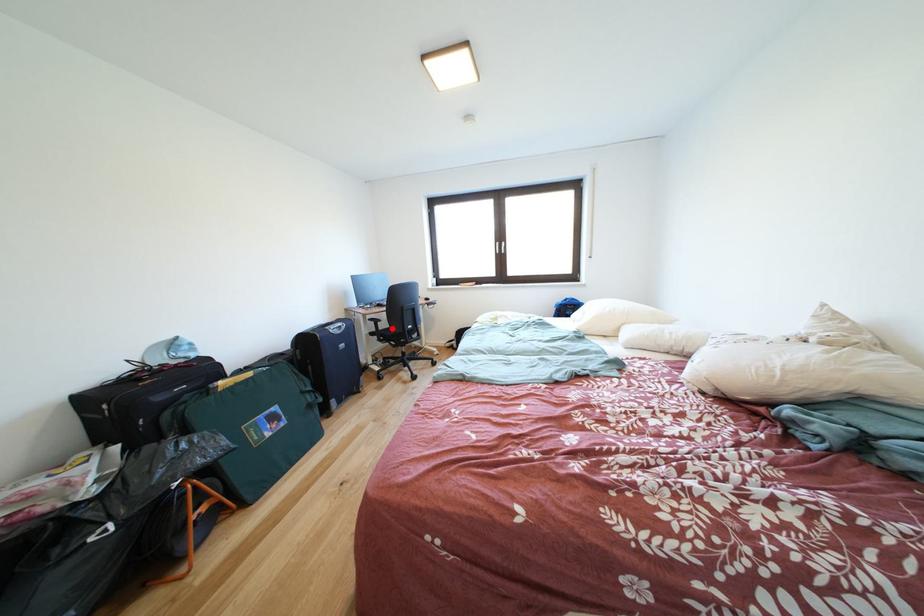
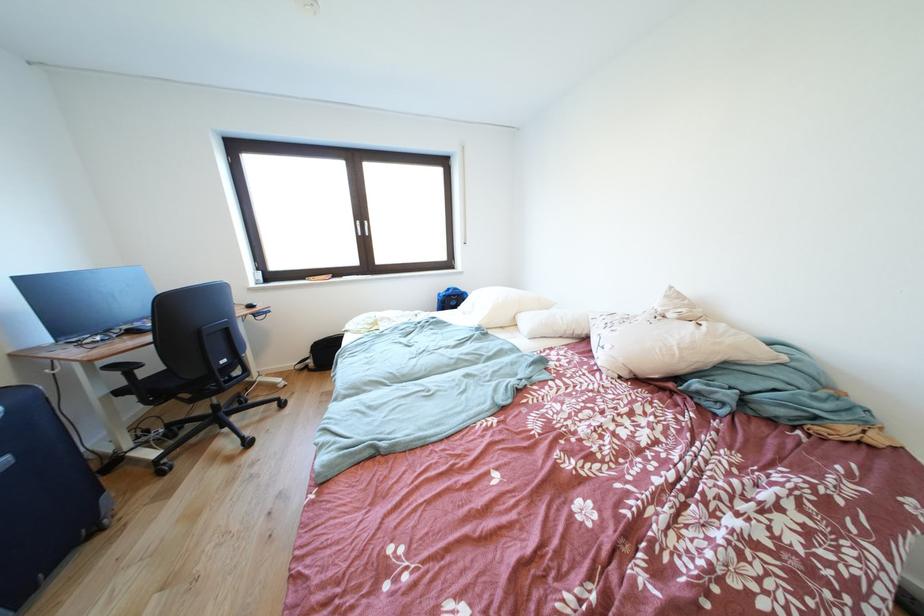
In the second image, find the point that corresponds to the highlighted location in the first image.

(161, 373)